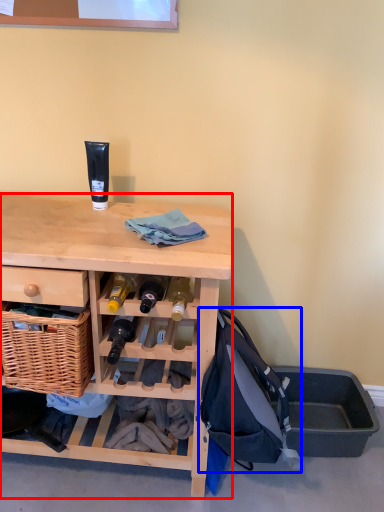
Question: Which of the following is the closest to the observer, desk (highlighted by a red box) or backpack (highlighted by a blue box)?

Choices:
 (A) desk
 (B) backpack

Answer: (A)